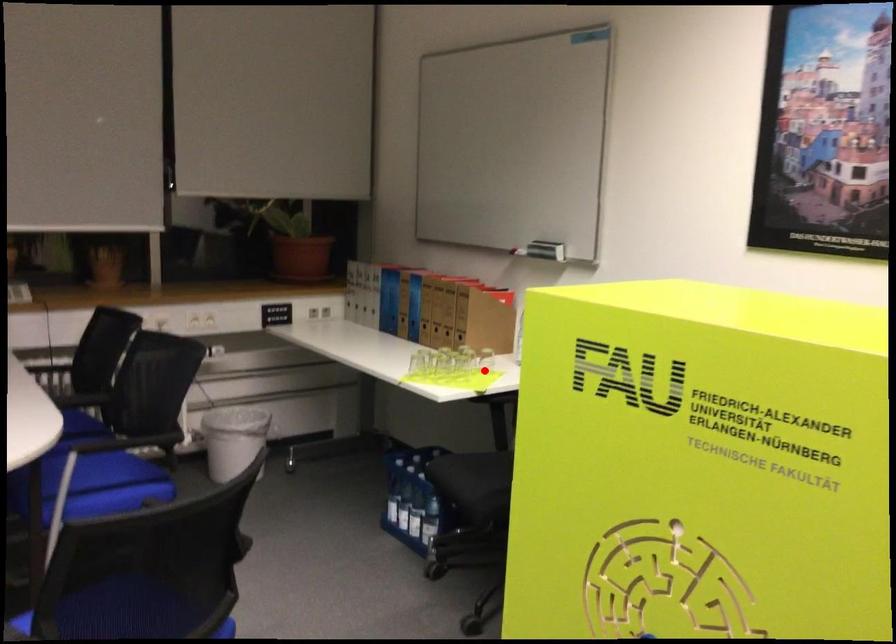
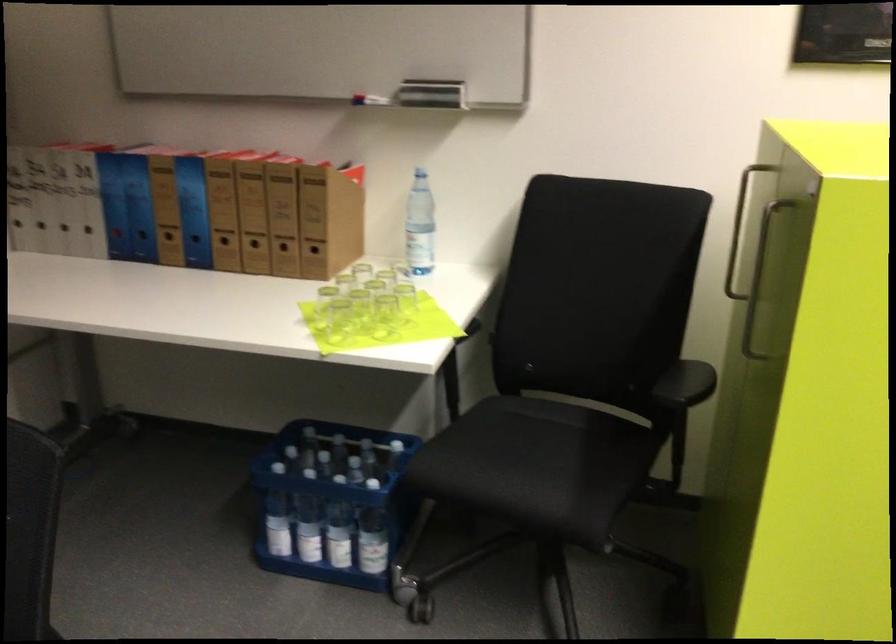
Question: I am providing you with two images of the same scene from different viewpoints. Given a red point in image1, look at the same physical point in image2. Is it:

Choices:
 (A) Closer to the viewpoint
 (B) Farther from the viewpoint

Answer: (A)